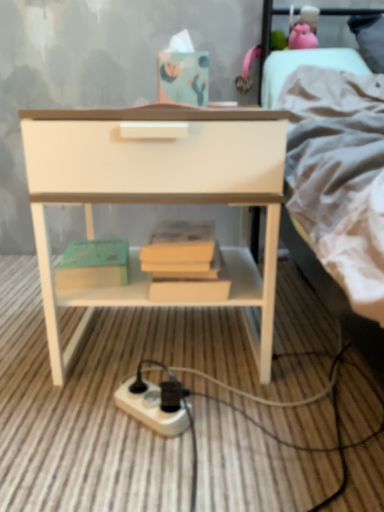
Find the location of `vacant area that is situated to the right of white glossy nightstand at center`. vacant area that is situated to the right of white glossy nightstand at center is located at coordinates (321, 369).